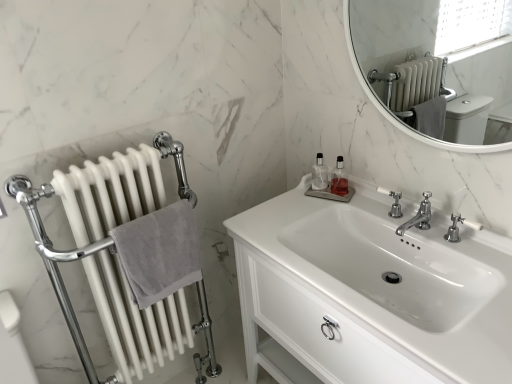
This screenshot has height=384, width=512. Identify the location of free point behind polished chrome faucet at center, which ranks as the 1th tap in left-to-right order. (382, 217).